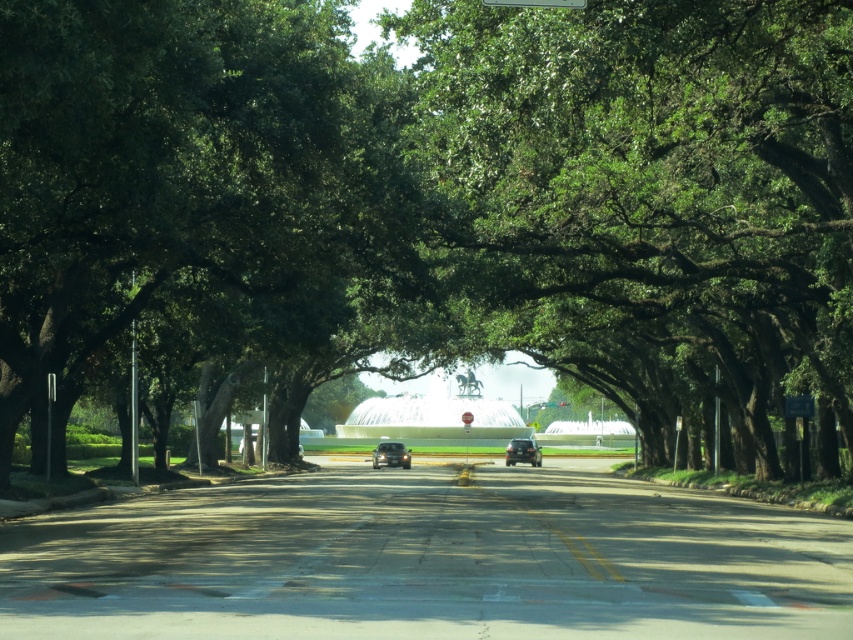
Question: Which object is positioned farthest from the shiny black car at center?

Choices:
 (A) green leafy tree at center
 (B) shiny silver sedan at center

Answer: (A)

Question: Which point is closer to the camera taking this photo?

Choices:
 (A) click(496, 243)
 (B) click(560, 1)
 (C) click(390, 448)
 (D) click(517, 456)

Answer: (B)

Question: Which object appears farthest from the camera in this image?

Choices:
 (A) green leafy tree at center
 (B) shiny silver sedan at center
 (C) shiny black car at center

Answer: (C)

Question: Is the position of shiny silver sedan at center more distant than that of shiny black car at center?

Choices:
 (A) no
 (B) yes

Answer: (A)

Question: Is green leafy tree at center smaller than green plastic street sign at upper center?

Choices:
 (A) yes
 (B) no

Answer: (B)

Question: Does shiny silver sedan at center have a larger size compared to green plastic street sign at upper center?

Choices:
 (A) yes
 (B) no

Answer: (A)